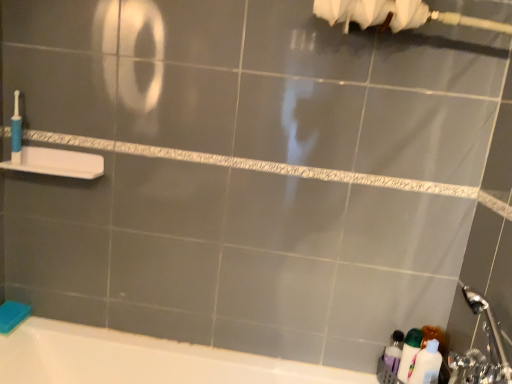
Question: Should I look upward or downward to see white glossy bottle at lower right?

Choices:
 (A) down
 (B) up

Answer: (A)

Question: Is white plastic shelf at left positioned behind translucent plastic bottles at lower right?

Choices:
 (A) no
 (B) yes

Answer: (B)

Question: Can you confirm if white plastic shelf at left is thinner than translucent plastic bottles at lower right?

Choices:
 (A) yes
 (B) no

Answer: (B)

Question: Is the surface of white plastic shelf at left in direct contact with translucent plastic bottles at lower right?

Choices:
 (A) yes
 (B) no

Answer: (B)

Question: From a real-world perspective, is white plastic shelf at left physically below translucent plastic bottles at lower right?

Choices:
 (A) yes
 (B) no

Answer: (B)

Question: Considering the relative sizes of white plastic shelf at left and translucent plastic bottles at lower right in the image provided, is white plastic shelf at left smaller than translucent plastic bottles at lower right?

Choices:
 (A) yes
 (B) no

Answer: (B)

Question: Can you confirm if white plastic shelf at left is wider than translucent plastic bottles at lower right?

Choices:
 (A) yes
 (B) no

Answer: (A)

Question: Is translucent plastic bottles at lower right further to the viewer compared to white plastic shelf at left?

Choices:
 (A) yes
 (B) no

Answer: (B)

Question: Does translucent plastic bottles at lower right appear on the left side of white plastic shelf at left?

Choices:
 (A) yes
 (B) no

Answer: (B)

Question: From a real-world perspective, is translucent plastic bottles at lower right on white plastic shelf at left?

Choices:
 (A) no
 (B) yes

Answer: (A)

Question: Would you consider translucent plastic bottles at lower right to be distant from white plastic shelf at left?

Choices:
 (A) yes
 (B) no

Answer: (A)

Question: Is translucent plastic bottles at lower right beside white plastic shelf at left?

Choices:
 (A) yes
 (B) no

Answer: (B)

Question: From the image's perspective, would you say translucent plastic bottles at lower right is shown under white plastic shelf at left?

Choices:
 (A) no
 (B) yes

Answer: (B)

Question: Is blue plastic toothbrush at left next to translucent plastic bottles at lower right?

Choices:
 (A) no
 (B) yes

Answer: (A)